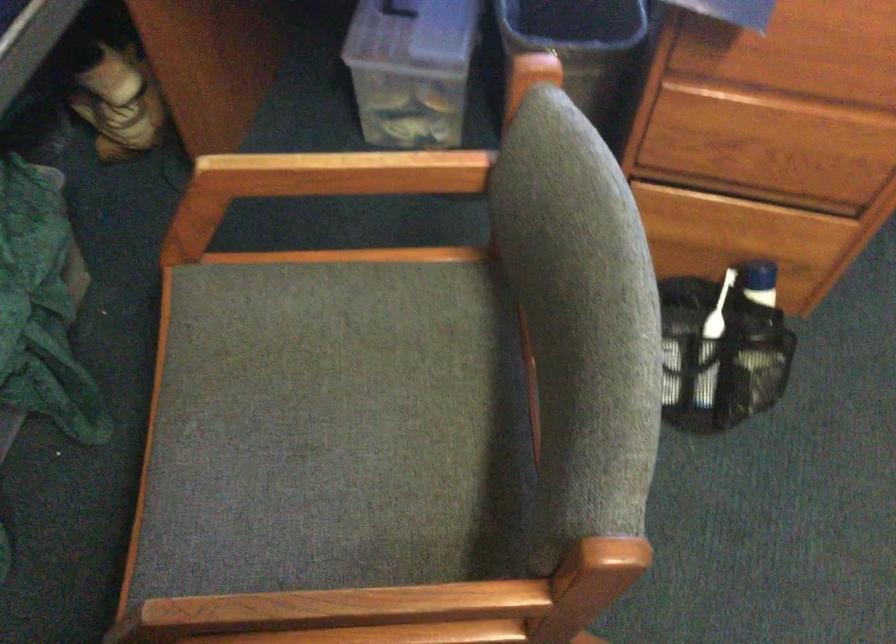
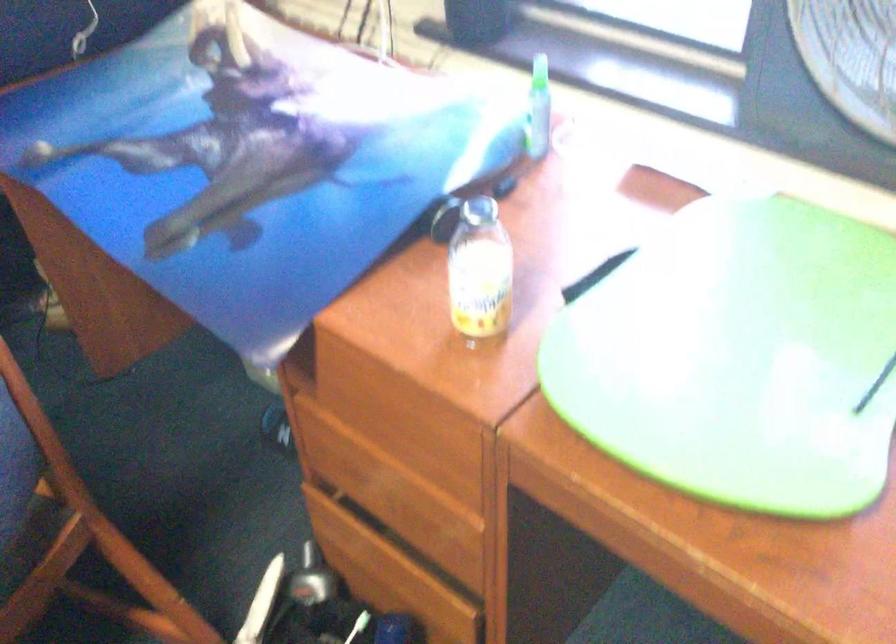
In the second image, find the point that corresponds to (798,73) in the first image.

(383, 435)